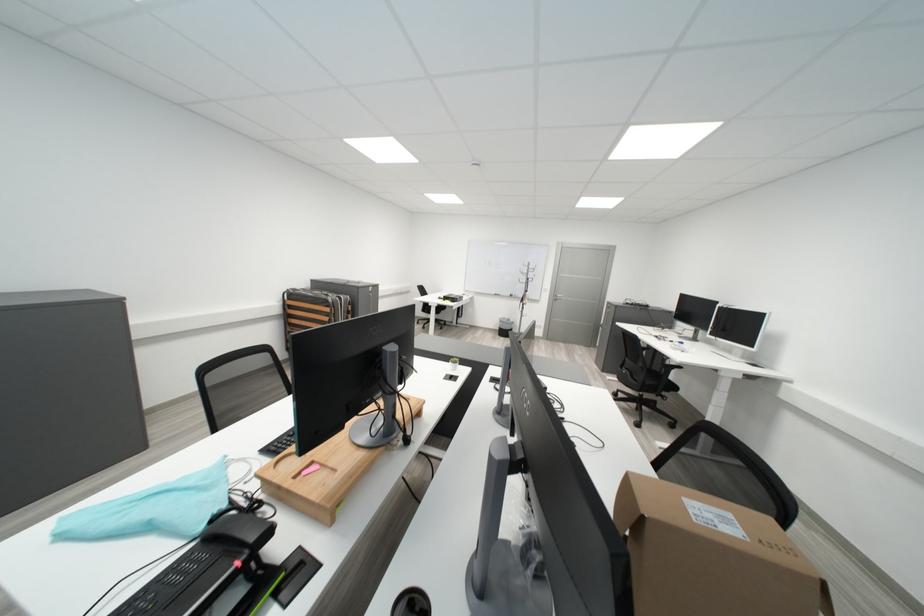
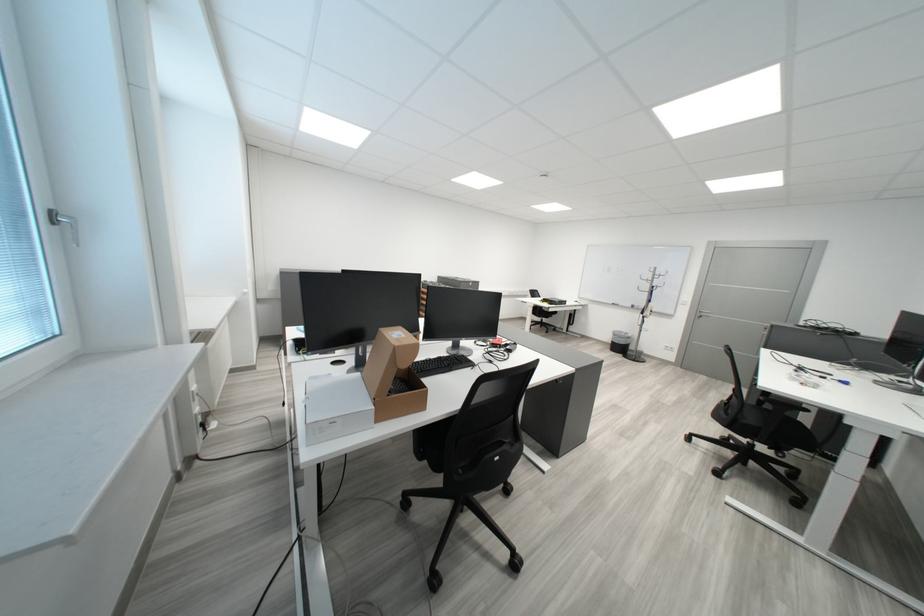
The point at (664, 383) is marked in the first image. Where is the corresponding point in the second image?

(763, 422)